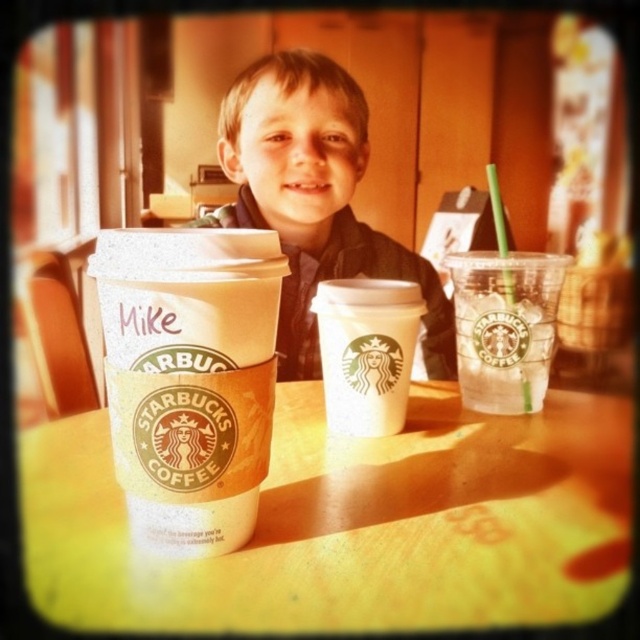
The boy is wearing a matte black jacket at center. Can you confirm if the point at coordinates [314,198] on the image corresponds to the matte black jacket at center?

Yes, the point at coordinates [314,198] corresponds to the matte black jacket at center as stated in the objects description.

You are standing in a Starbucks and want to place your phone on the yellow matte table at center. Considering the table is 10.58 inches away from you, can you comfortably reach it without moving your chair?

The yellow matte table at center is 10.58 inches away from the viewer, so yes, you can comfortably reach it without moving your chair since the distance is within typical arm reach.

You are a customer at the Starbucks counter and you want to place your order. You see a yellow matte table at center and a white paper cup at left. Which object is located to the right of the other?

The yellow matte table at center is positioned on the right side of white paper cup at left, so the yellow matte table at center is to the right of the white paper cup at left.